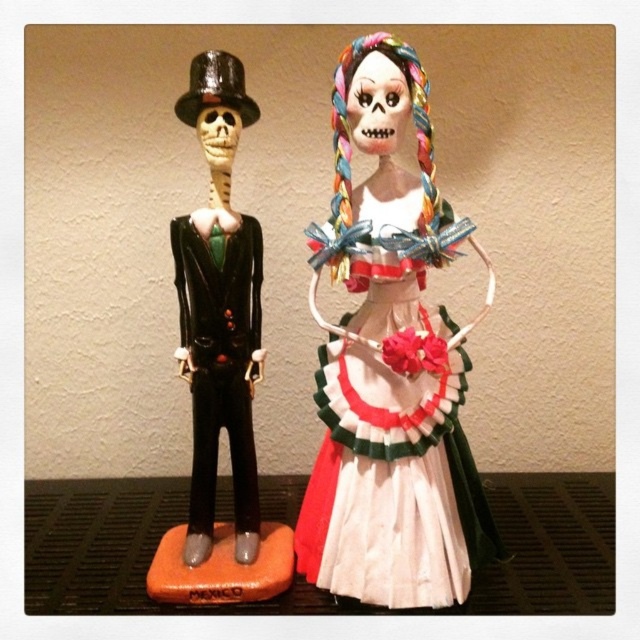
Is matte black skeleton at left thinner than white paper dress at center?

In fact, matte black skeleton at left might be wider than white paper dress at center.

Where is `matte black skeleton at left`? Image resolution: width=640 pixels, height=640 pixels. matte black skeleton at left is located at coordinates (390, 362).

The image size is (640, 640). What are the coordinates of `matte black skeleton at left` in the screenshot? It's located at (390, 362).